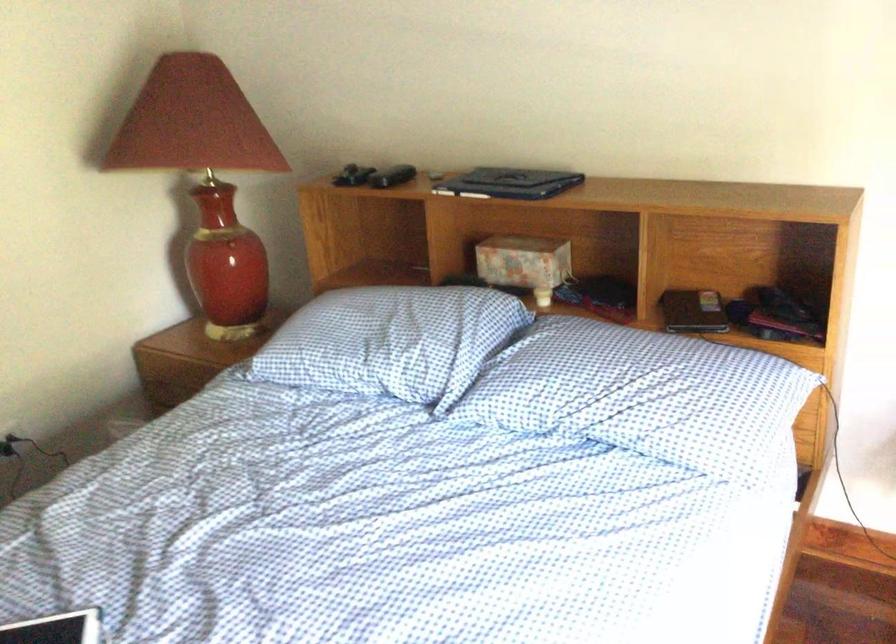
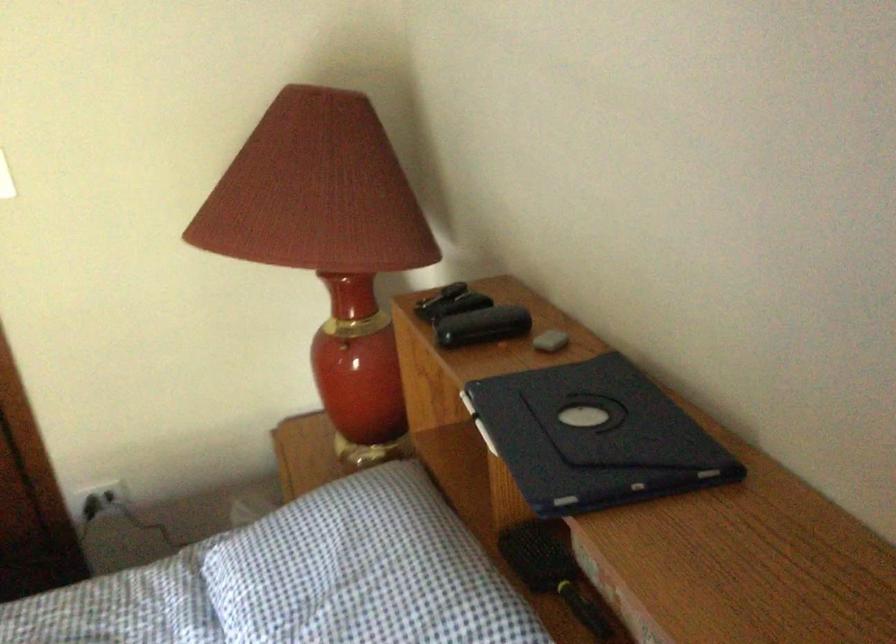
Locate, in the second image, the point that corresponds to point 477,287 in the first image.

(552, 571)